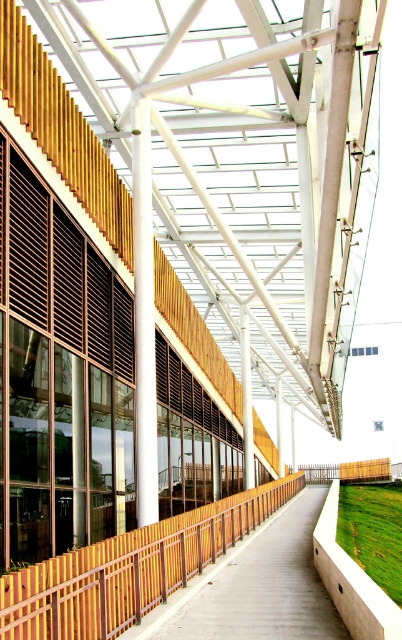
Question: Does smooth concrete pavement at center have a greater width compared to white matte pillar at center?

Choices:
 (A) no
 (B) yes

Answer: (B)

Question: Which of the following is the closest to the observer?

Choices:
 (A) yellow corrugated metal fence at center
 (B) green grass at lower right
 (C) white smooth column at center

Answer: (A)

Question: Does smooth concrete pavement at center appear on the left side of white matte pillar at center?

Choices:
 (A) no
 (B) yes

Answer: (B)

Question: Which point is farther to the camera?

Choices:
 (A) (149, 141)
 (B) (297, 570)

Answer: (A)

Question: Is yellow corrugated metal fence at center above smooth concrete pavement at center?

Choices:
 (A) no
 (B) yes

Answer: (B)

Question: Which object is closer to the camera taking this photo?

Choices:
 (A) white smooth column at center
 (B) white matte pillar at center
 (C) yellow corrugated metal fence at center
 (D) green grass at lower right

Answer: (C)